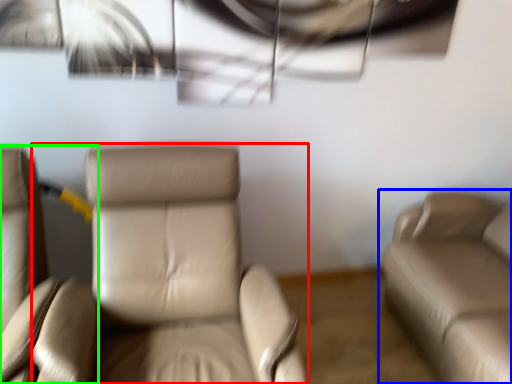
Question: Based on their relative distances, which object is farther from chair (highlighted by a red box)? Choose from studio couch (highlighted by a blue box) and chair (highlighted by a green box).

Choices:
 (A) studio couch
 (B) chair

Answer: (A)